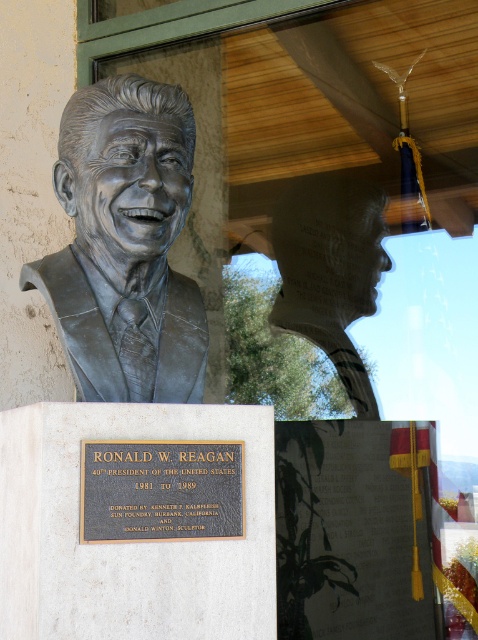
Question: Is bronze statue at center to the right of bronze bust at center from the viewer's perspective?

Choices:
 (A) yes
 (B) no

Answer: (B)

Question: Which of the following is the farthest from the observer?

Choices:
 (A) (311, 220)
 (B) (98, 461)
 (C) (144, 310)

Answer: (A)

Question: Which of these objects is positioned farthest from the bronze statue at center?

Choices:
 (A) bronze bust at center
 (B) bronze plaque at center

Answer: (A)

Question: Observing the image, what is the correct spatial positioning of bronze bust at center in reference to bronze plaque at center?

Choices:
 (A) below
 (B) above

Answer: (B)

Question: Does bronze statue at center come in front of bronze plaque at center?

Choices:
 (A) no
 (B) yes

Answer: (A)

Question: Based on their relative distances, which object is nearer to the bronze statue at center?

Choices:
 (A) bronze plaque at center
 (B) bronze bust at center

Answer: (A)